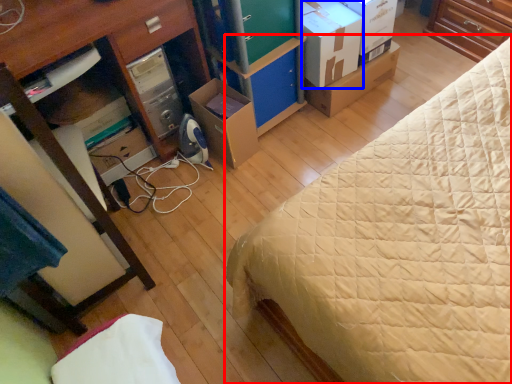
Question: Which object is further to the camera taking this photo, bed (highlighted by a red box) or cardboard box (highlighted by a blue box)?

Choices:
 (A) bed
 (B) cardboard box

Answer: (B)